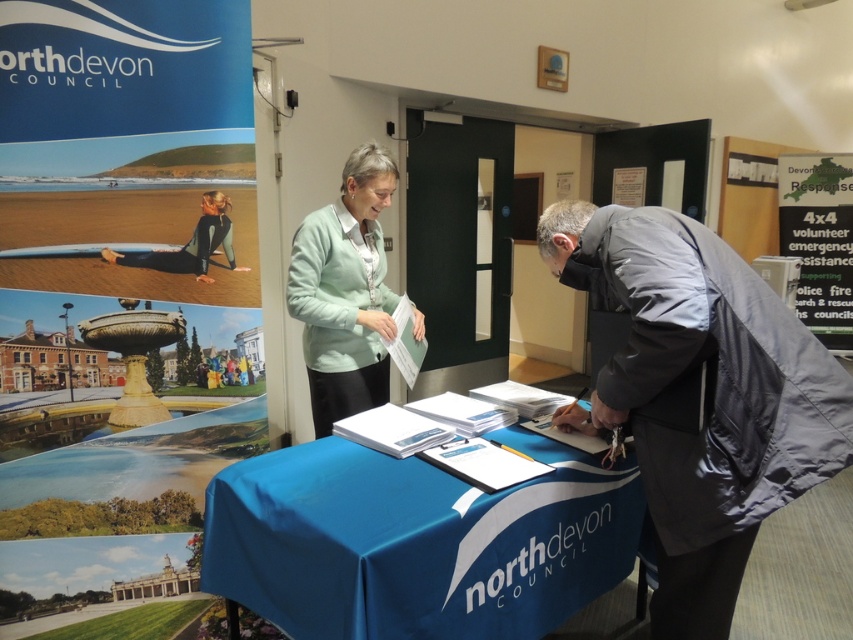
Does light blue fabric tablecloth at center have a smaller size compared to light green fabric at center?

→ Actually, light blue fabric tablecloth at center might be larger than light green fabric at center.

Which is behind, point (589, 212) or point (338, 253)?

Positioned behind is point (338, 253).

Locate an element on the screen. The image size is (853, 640). light blue fabric tablecloth at center is located at coordinates (701, 394).

Looking at this image, does dark gray jacket at lower right appear on the right side of blue fabric table at center?

Yes, dark gray jacket at lower right is to the right of blue fabric table at center.

Locate an element on the screen. Image resolution: width=853 pixels, height=640 pixels. dark gray jacket at lower right is located at coordinates (699, 396).

Is point (809, 340) behind point (630, 371)?

Yes.

Between dark gray jacket at lower right and light blue fabric tablecloth at center, which one appears on the right side from the viewer's perspective?

Positioned to the right is dark gray jacket at lower right.

Find the location of a particular element. The height and width of the screenshot is (640, 853). dark gray jacket at lower right is located at coordinates (699, 396).